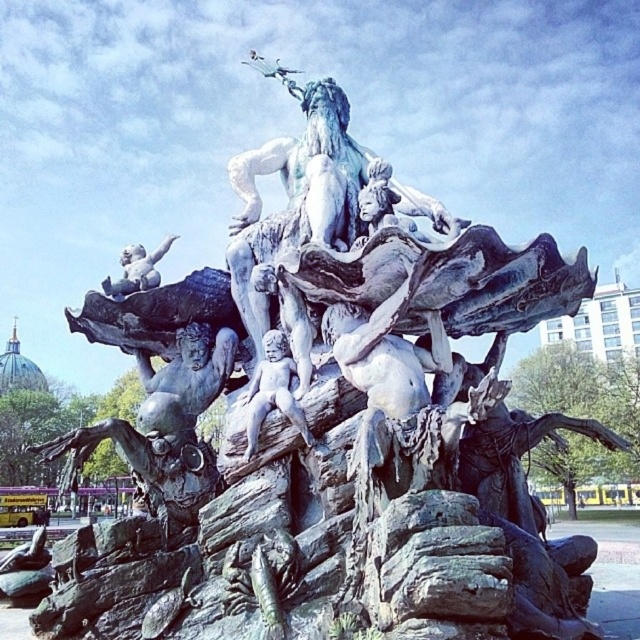
You are a city planner reviewing the fountain sculpture design. The city requires all central elements to be placed within the central 20x20 meter area. Given that the fountain spans 100 meters in width, can the matte bronze cherub at center be considered centrally located?

The matte bronze cherub at center is positioned at coordinates point (273,390). Since the fountain spans 100 meters, the central 20x20 meter area would be from 40 to 60 meters in both x and y directions. The coordinates 0.611 and 0.427 likely represent normalized values between 0 and 1, so converting them to meters would place the cherub at approximately 61.1 meters x and 42.7 meters y. This falls within the central 20x20 meter area, so yes, it is centrally located.

You are an art student observing the fountain sculpture. You notice two bronze cherubs. Which one is closer to you, the matte bronze cherub at center or the bronze cherub at upper left?

The matte bronze cherub at center is closer to you because it is in front of the bronze cherub at upper left.